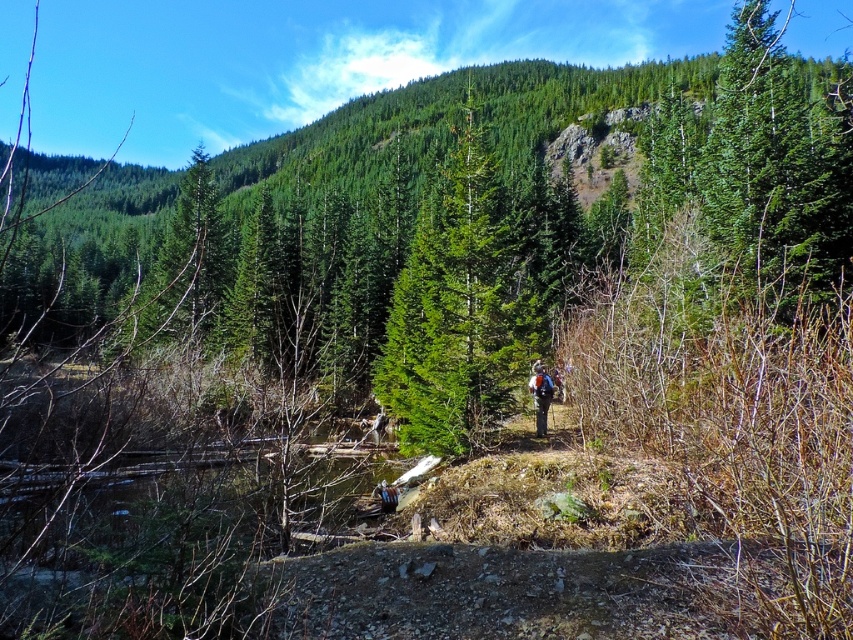
Who is shorter, green matte tree at center or camouflage backpack at center?

With less height is camouflage backpack at center.

Who is taller, green matte tree at center or camouflage backpack at center?

green matte tree at center

This screenshot has height=640, width=853. In order to click on green matte tree at center in this screenshot , I will do `click(456, 310)`.